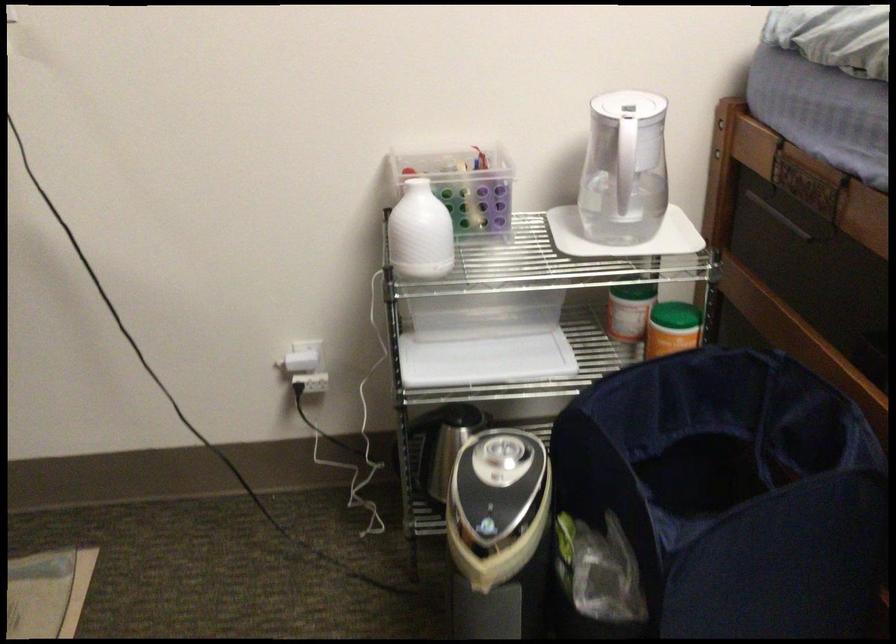
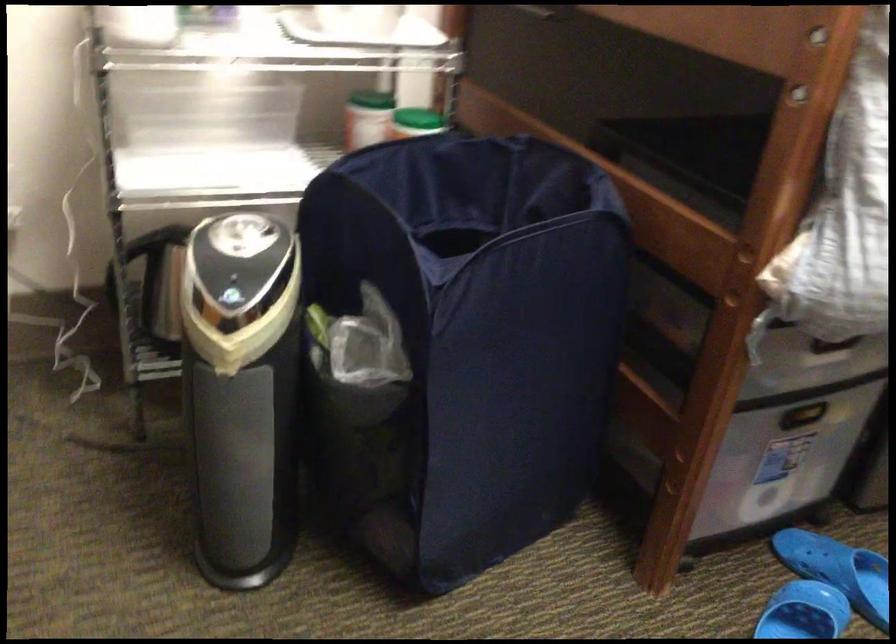
Question: The camera is either moving clockwise (left) or counter-clockwise (right) around the object. The first image is from the beginning of the video and the second image is from the end. Is the camera moving left or right when shooting the video?

Choices:
 (A) Left
 (B) Right

Answer: (A)